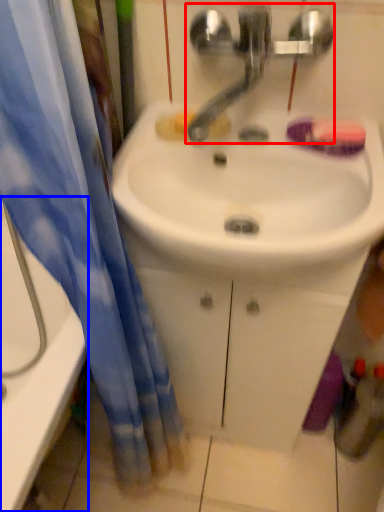
Question: Which object is further to the camera taking this photo, tap (highlighted by a red box) or bathtub (highlighted by a blue box)?

Choices:
 (A) tap
 (B) bathtub

Answer: (B)